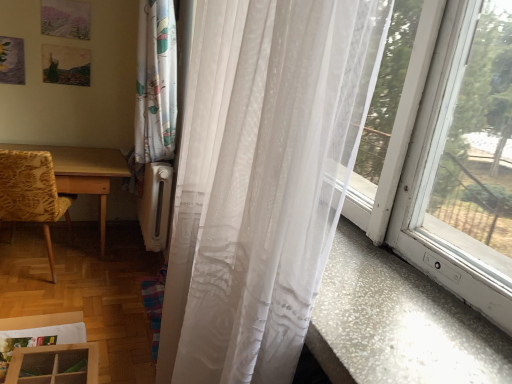
Question: Can you confirm if wooden table at left is positioned to the left of yellow floral fabric chair at left?

Choices:
 (A) no
 (B) yes

Answer: (A)

Question: From the image's perspective, is wooden table at left beneath yellow floral fabric chair at left?

Choices:
 (A) yes
 (B) no

Answer: (A)

Question: Is wooden table at left not close to yellow floral fabric chair at left?

Choices:
 (A) yes
 (B) no

Answer: (B)

Question: From a real-world perspective, does wooden table at left sit lower than yellow floral fabric chair at left?

Choices:
 (A) yes
 (B) no

Answer: (A)

Question: Is wooden table at left positioned in front of yellow floral fabric chair at left?

Choices:
 (A) no
 (B) yes

Answer: (A)

Question: Does wooden table at left have a greater height compared to yellow floral fabric chair at left?

Choices:
 (A) yes
 (B) no

Answer: (B)

Question: Does wooden table at left turn towards translucent white curtain at right?

Choices:
 (A) no
 (B) yes

Answer: (B)

Question: Is translucent white curtain at right surrounded by wooden table at left?

Choices:
 (A) yes
 (B) no

Answer: (B)

Question: Is wooden table at left facing away from translucent white curtain at right?

Choices:
 (A) yes
 (B) no

Answer: (B)

Question: Is wooden table at left located outside translucent white curtain at right?

Choices:
 (A) yes
 (B) no

Answer: (A)

Question: From a real-world perspective, is wooden table at left under translucent white curtain at right?

Choices:
 (A) no
 (B) yes

Answer: (B)

Question: From the image's perspective, is wooden table at left located above translucent white curtain at right?

Choices:
 (A) no
 (B) yes

Answer: (B)

Question: Can we say yellow floral fabric chair at left lies outside wooden table at left?

Choices:
 (A) yes
 (B) no

Answer: (B)